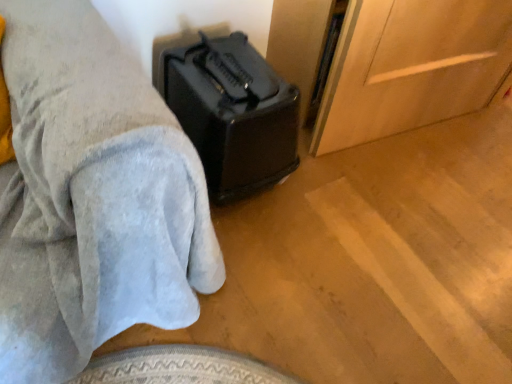
Question: Considering the positions of black plastic suitcase at center and black plastic speaker at lower left in the image, is black plastic suitcase at center taller or shorter than black plastic speaker at lower left?

Choices:
 (A) short
 (B) tall

Answer: (A)

Question: From a real-world perspective, is black plastic suitcase at center above or below black plastic speaker at lower left?

Choices:
 (A) below
 (B) above

Answer: (A)

Question: Considering the positions of black plastic suitcase at center and black plastic speaker at lower left in the image, is black plastic suitcase at center wider or thinner than black plastic speaker at lower left?

Choices:
 (A) thin
 (B) wide

Answer: (A)

Question: Looking at the image, does black plastic speaker at lower left seem bigger or smaller compared to black plastic suitcase at center?

Choices:
 (A) big
 (B) small

Answer: (A)

Question: In the image, is black plastic speaker at lower left positioned in front of or behind black plastic suitcase at center?

Choices:
 (A) front
 (B) behind

Answer: (A)

Question: Is black plastic speaker at lower left inside the boundaries of black plastic suitcase at center, or outside?

Choices:
 (A) outside
 (B) inside

Answer: (A)

Question: Does point (67, 114) appear closer or farther from the camera than point (246, 180)?

Choices:
 (A) farther
 (B) closer

Answer: (B)